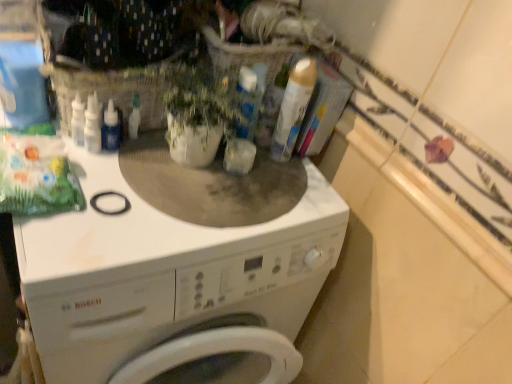
Identify the location of free spot above green matte plant at center (from a real-world perspective). The width and height of the screenshot is (512, 384). (221, 104).